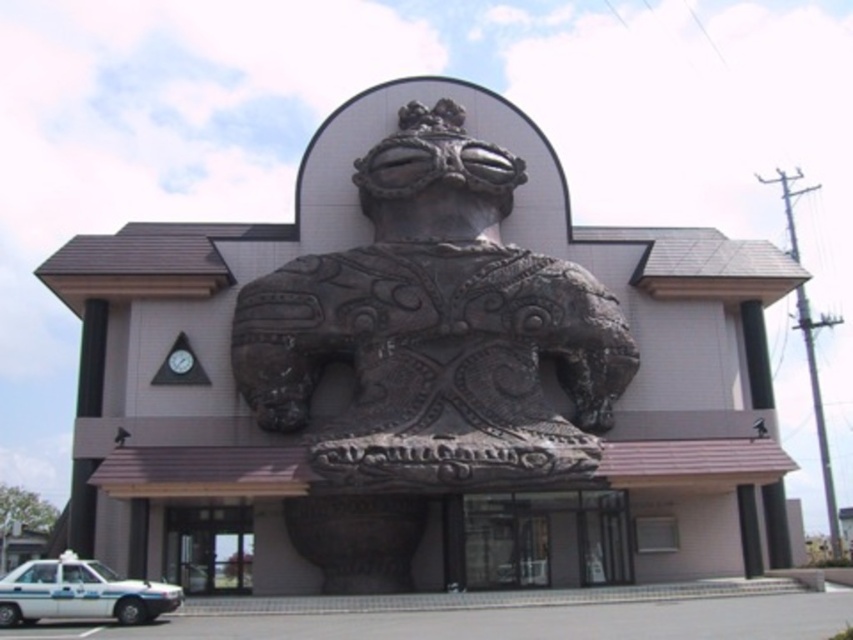
Which of these two, rustic stone statue at center or white glossy taxi at lower left, stands taller?

With more height is rustic stone statue at center.

Between point (460, 461) and point (0, 582), which one is positioned behind?

Positioned behind is point (460, 461).

I want to click on rustic stone statue at center, so click(x=434, y=332).